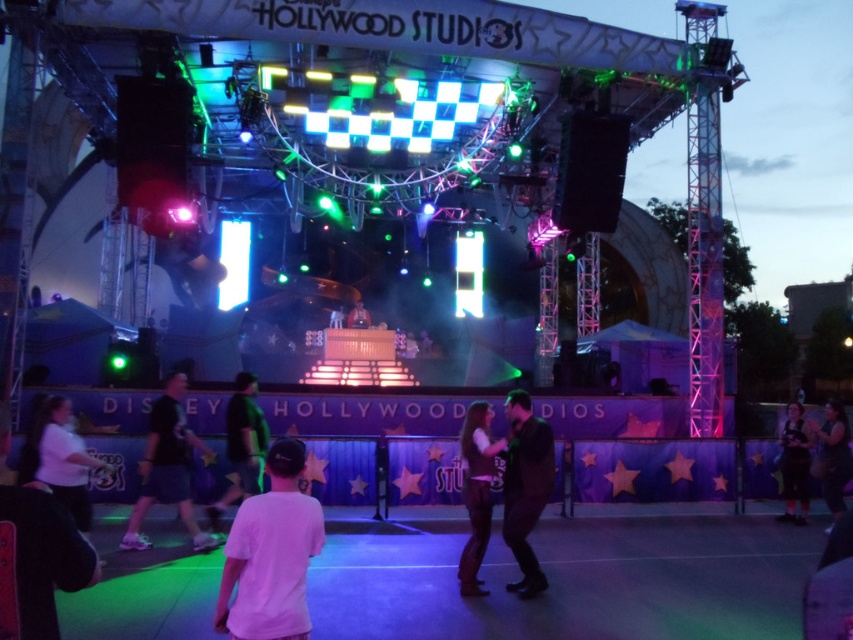
You are a costume designer observing the Disney stage scene. You need to decide which costume item can be folded into a smaller storage space. Based on their thickness, which one would you choose between the dark brown leather jacket at center and the dark gray fabric dress at lower right?

The dark brown leather jacket at center is thinner than the dark gray fabric dress at lower right, so it can be folded into a smaller storage space.

You are a photographer standing at the camera position. You want to capture a closeup shot of the dark brown suit at center. Considering the distance, is it feasible to take this photo without moving closer?

The dark brown suit at center is 127.38 feet from the camera. A closeup shot would require a telephoto lens with sufficient zoom capability to capture details from that distance.

You are a photographer at Disney Hollywood Studios and want to capture a photo of the dark brown suit at center and the matte black jacket at center. Which one is positioned lower in the image?

The dark brown suit at center is located below the matte black jacket at center, so it is positioned lower in the image.